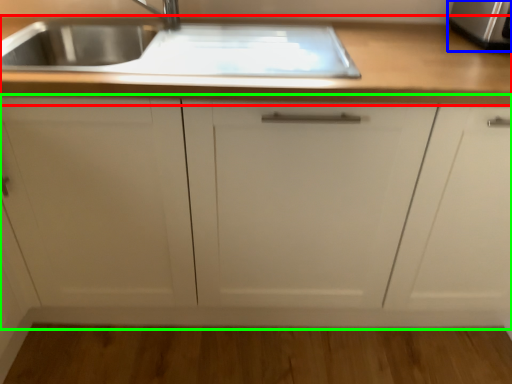
Question: Based on their relative distances, which object is nearer to countertop (highlighted by a red box)? Choose from stainless steel (highlighted by a blue box) and cabinetry (highlighted by a green box).

Choices:
 (A) stainless steel
 (B) cabinetry

Answer: (B)